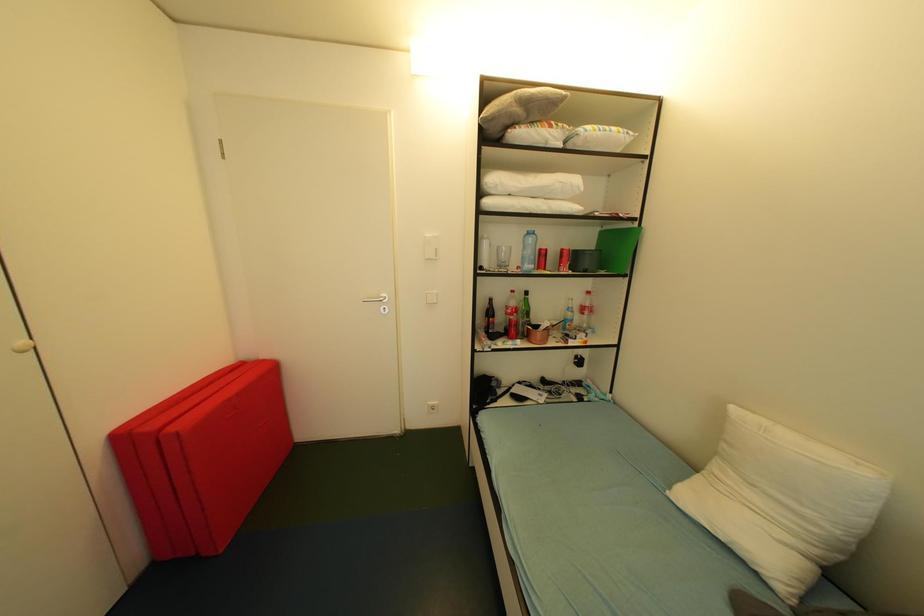
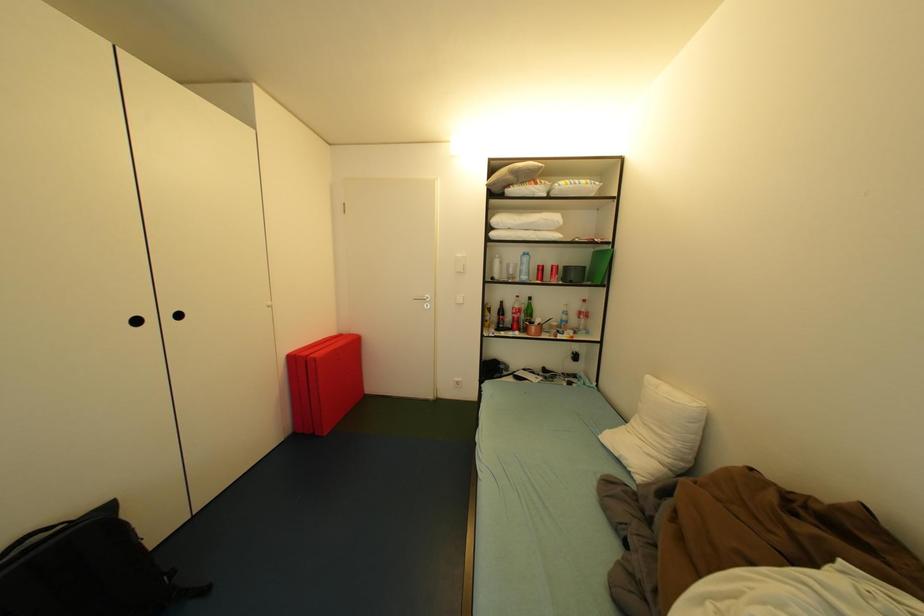
Question: Based on the continuous images, in which direction is the camera rotating? Reply with the corresponding letter.

Choices:
 (A) Left
 (B) Right
 (C) Up
 (D) Down

Answer: (A)